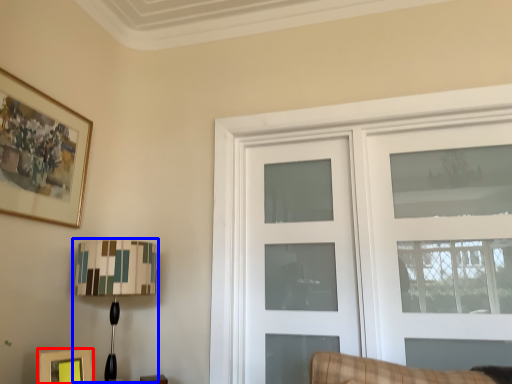
Question: Among these objects, which one is farthest to the camera, picture frame (highlighted by a red box) or table lamp (highlighted by a blue box)?

Choices:
 (A) picture frame
 (B) table lamp

Answer: (B)